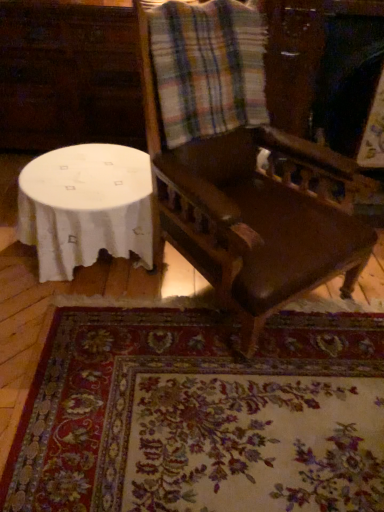
Question: Can you confirm if dark brown wood chair at center is bigger than floral carpet at lower center?

Choices:
 (A) yes
 (B) no

Answer: (A)

Question: From a real-world perspective, is dark brown wood chair at center over floral carpet at lower center?

Choices:
 (A) yes
 (B) no

Answer: (A)

Question: Is dark brown wood chair at center not close to floral carpet at lower center?

Choices:
 (A) yes
 (B) no

Answer: (B)

Question: Is dark brown wood chair at center further to the viewer compared to floral carpet at lower center?

Choices:
 (A) yes
 (B) no

Answer: (B)

Question: Is floral carpet at lower center surrounded by dark brown wood chair at center?

Choices:
 (A) no
 (B) yes

Answer: (A)

Question: From the image's perspective, does dark brown wood chair at center appear higher than floral carpet at lower center?

Choices:
 (A) yes
 (B) no

Answer: (A)

Question: Does white cloth-covered table at lower left lie in front of plaid fabric at upper center?

Choices:
 (A) yes
 (B) no

Answer: (B)

Question: Is white cloth-covered table at lower left positioned far away from plaid fabric at upper center?

Choices:
 (A) no
 (B) yes

Answer: (A)

Question: Can you confirm if white cloth-covered table at lower left is bigger than plaid fabric at upper center?

Choices:
 (A) yes
 (B) no

Answer: (B)

Question: Is white cloth-covered table at lower left at the left side of plaid fabric at upper center?

Choices:
 (A) no
 (B) yes

Answer: (B)

Question: Does white cloth-covered table at lower left have a greater width compared to plaid fabric at upper center?

Choices:
 (A) yes
 (B) no

Answer: (A)

Question: Is white cloth-covered table at lower left facing towards plaid fabric at upper center?

Choices:
 (A) no
 (B) yes

Answer: (A)

Question: Is plaid fabric at upper center at the right side of white cloth-covered table at lower left?

Choices:
 (A) yes
 (B) no

Answer: (A)